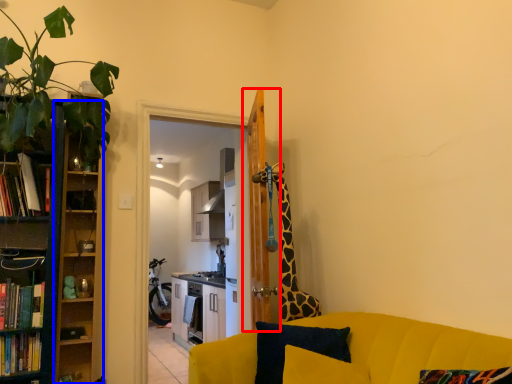
Question: Which of the following is the farthest to the observer, door (highlighted by a red box) or cabinet (highlighted by a blue box)?

Choices:
 (A) door
 (B) cabinet

Answer: (A)